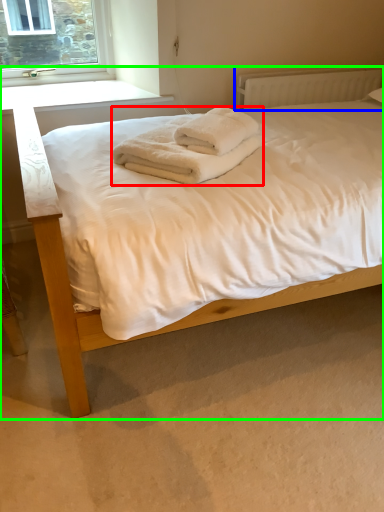
Question: Which is nearer to the bath towel (highlighted by a red box)? radiator (highlighted by a blue box) or bed (highlighted by a green box).

Choices:
 (A) radiator
 (B) bed

Answer: (B)